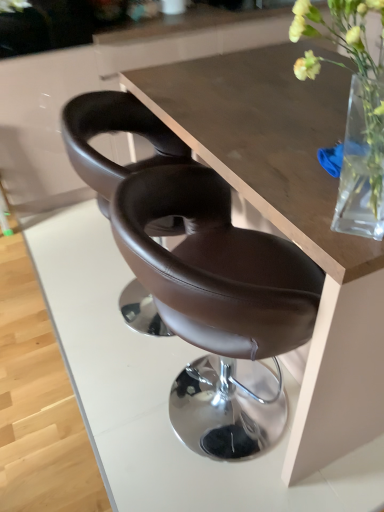
Locate an element on the screen. vacant space situated on the left part of brown leather chair at center, which is counted as the 1th chair, starting from the front is located at coordinates (82, 413).